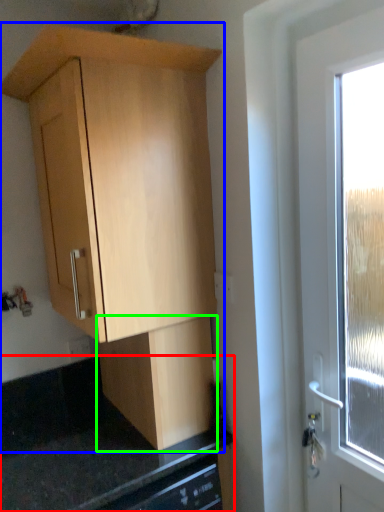
Question: Based on their relative distances, which object is farther from counter top (highlighted by a red box)? Choose from cabinetry (highlighted by a blue box) and cabinetry (highlighted by a green box).

Choices:
 (A) cabinetry
 (B) cabinetry

Answer: (A)